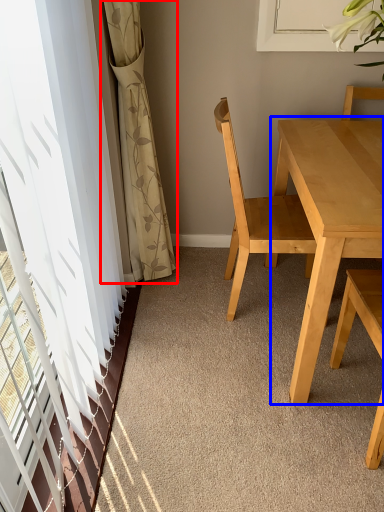
Question: Which object is closer to the camera taking this photo, curtain (highlighted by a red box) or kitchen & dining room table (highlighted by a blue box)?

Choices:
 (A) curtain
 (B) kitchen & dining room table

Answer: (B)